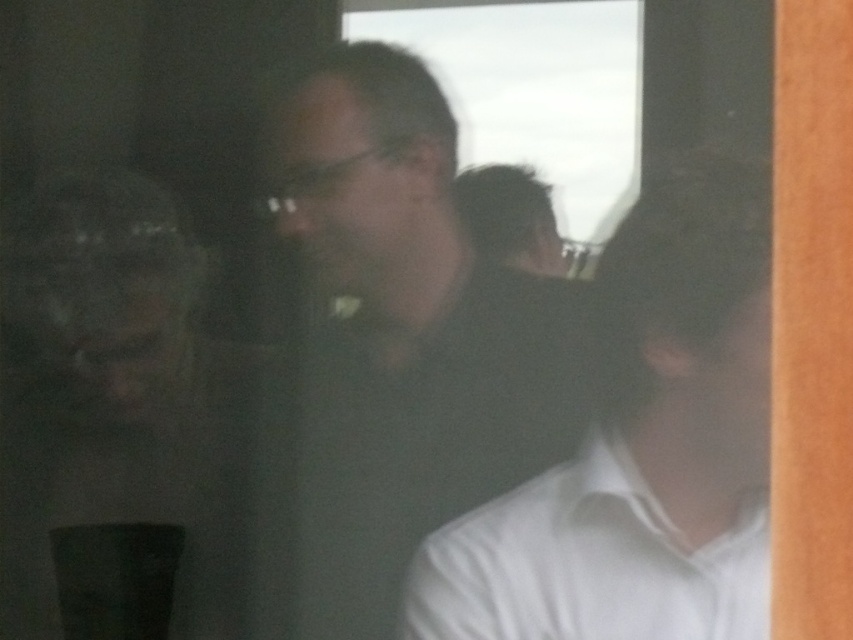
Question: Which point appears farthest from the camera in this image?

Choices:
 (A) (376, 99)
 (B) (543, 632)

Answer: (A)

Question: Is matte black shirt at center further to the viewer compared to white matte shirt at center?

Choices:
 (A) yes
 (B) no

Answer: (A)

Question: From the image, what is the correct spatial relationship of white matte shirt at center in relation to white cotton dress shirt at lower right?

Choices:
 (A) left
 (B) right

Answer: (B)

Question: Does matte black shirt at center have a greater width compared to white cotton dress shirt at lower right?

Choices:
 (A) yes
 (B) no

Answer: (B)

Question: Which point is closer to the camera?

Choices:
 (A) (434, 563)
 (B) (761, 522)

Answer: (B)

Question: Which object is farther from the camera taking this photo?

Choices:
 (A) white cotton dress shirt at lower right
 (B) matte black shirt at center

Answer: (B)